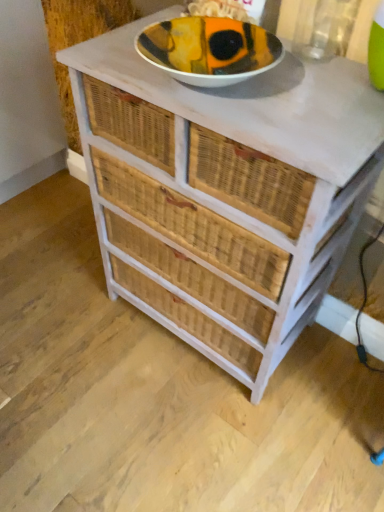
The width and height of the screenshot is (384, 512). Describe the element at coordinates (225, 191) in the screenshot. I see `white wicker chest of drawers at center` at that location.

You are a GUI agent. You are given a task and a screenshot of the screen. Output one action in this format:
    pyautogui.click(x=<x>, y=<y>)
    Task: Click on the white wicker chest of drawers at center
    The height and width of the screenshot is (512, 384).
    Given the screenshot: What is the action you would take?
    (x=225, y=191)

This screenshot has height=512, width=384. In order to click on white wicker chest of drawers at center in this screenshot , I will do `click(225, 191)`.